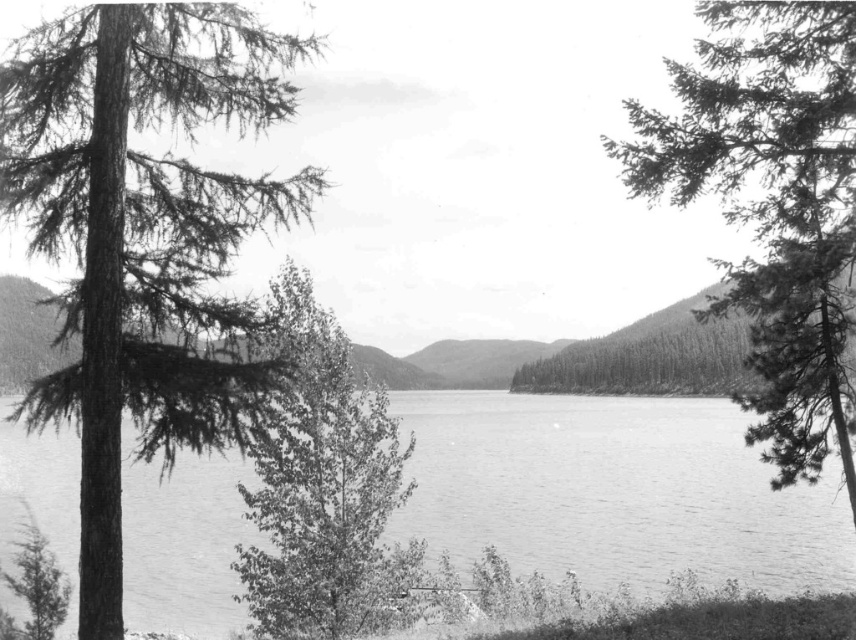
A person is standing at point A located at coordinates point A is at point (815, 371). They want to walk straight towards the lake in the center. Is there any obstruction between point A and the lake?

The distance between point A at point (815, 371) and the lake in the center is 13.26 meters. Since the scene describes trees with branches extending diagonally across the left side of the frame, which partially obscure the view of the lake, there might be obstructions like tree branches between point A and the lake. However, the exact path isn not specified in the object descriptions, so it depends on the actual layout.